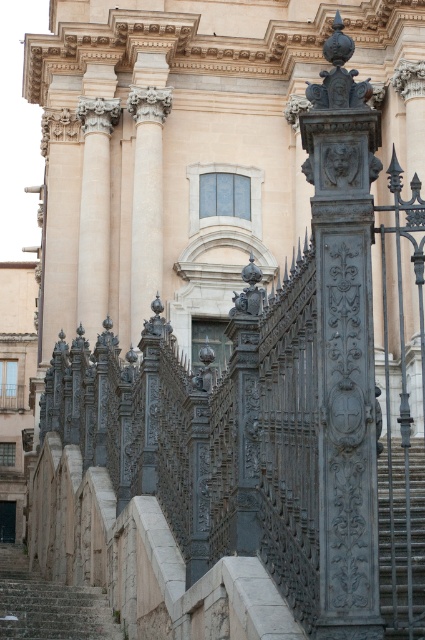
You are standing at the base of the grand building and want to locate the gray metallic column at right. Based on the coordinates provided, where should you look relative to the image center?

The gray metallic column at right is located at coordinates point (343,342), which means it is positioned to the right and slightly above the image center.

You are standing at the base of the dark gray stone stairs at lower right and want to reach the entrance of the building. Which direction should you move relative to the gray metallic column at right to ascend the stairs?

You should move towards the gray metallic column at right to ascend the stairs since it is located above the dark gray stone stairs at lower right, indicating the stairs lead upward toward the column.

You are an architect designing a new pathway between the dark gray stone stairs at lower right and the stone stairs at lower left. The pathway must be at least 50 feet long. Can the existing space accommodate this requirement?

The distance between the dark gray stone stairs at lower right and the stone stairs at lower left is 50.60 feet, which exceeds the required 50 feet. Therefore, the existing space can accommodate the pathway.